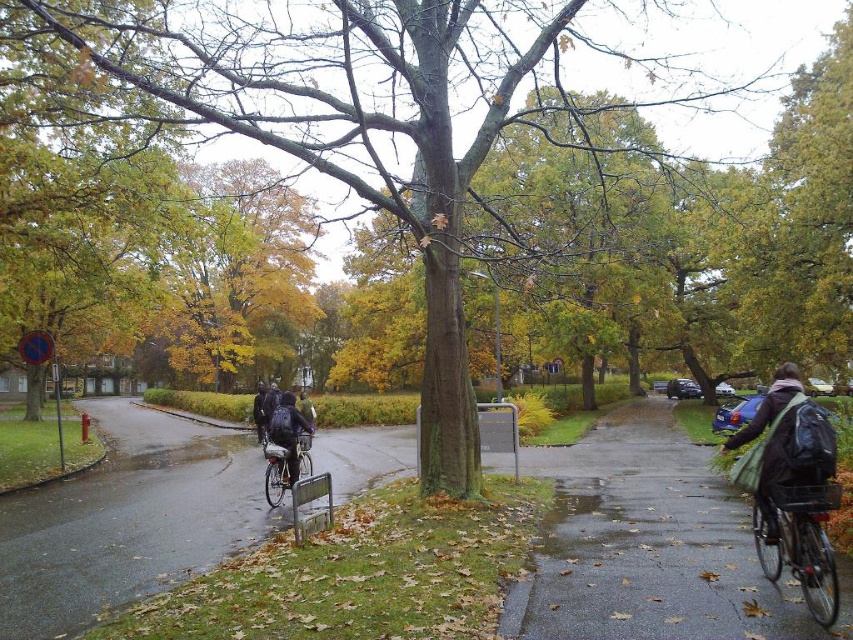
Between point (788, 387) and point (296, 449), which one is positioned behind?

Positioned behind is point (296, 449).

The height and width of the screenshot is (640, 853). I want to click on green backpack at right, so click(x=787, y=445).

Where is `green backpack at right`? This screenshot has height=640, width=853. green backpack at right is located at coordinates (787, 445).

Describe the element at coordinates (787, 445) in the screenshot. I see `green backpack at right` at that location.

The image size is (853, 640). In order to click on green backpack at right in this screenshot , I will do `click(787, 445)`.

Who is higher up, dark blue backpack at center or silver metallic bicycle at center?

dark blue backpack at center is higher up.

Does dark blue backpack at center have a greater width compared to silver metallic bicycle at center?

Yes.

Based on the photo, who is more distant from viewer, (287, 401) or (308, 465)?

Positioned behind is point (308, 465).

Locate an element on the screen. The width and height of the screenshot is (853, 640). dark blue backpack at center is located at coordinates (288, 433).